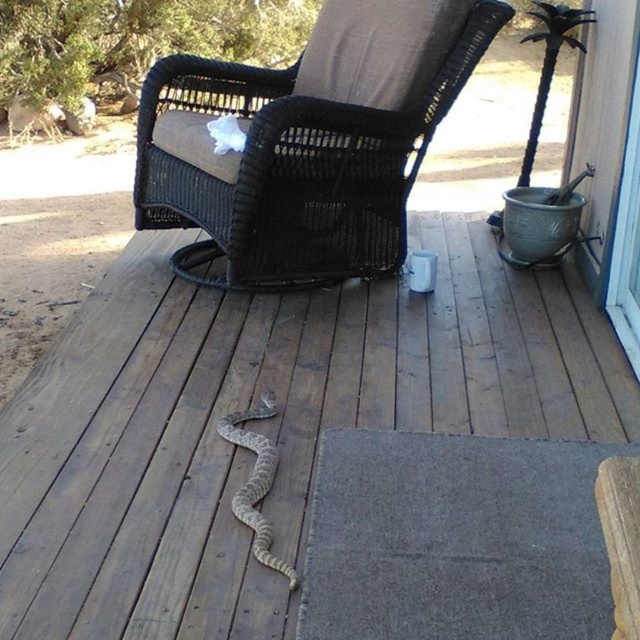
You are a gardener who just noticed a brown textured snake at center near your black wicker chair at center. You want to safely move the chair away from the snake. Given that the snake is 20.52 inches away from the chair, is there enough space to move the chair without disturbing the snake?

Answer: The brown textured snake at center and the black wicker chair at center are 20.52 inches apart. Since the distance is sufficient, you can carefully move the chair away without getting too close to the snake, ensuring safety for both yourself and the snake.

You are a delivery person trying to enter the house through the transparent glass screen door at right or the transparent glass screen door at upper right. Which door is wider and more suitable for carrying a large package?

The transparent glass screen door at right is wider than the transparent glass screen door at upper right, so it is more suitable for carrying a large package.